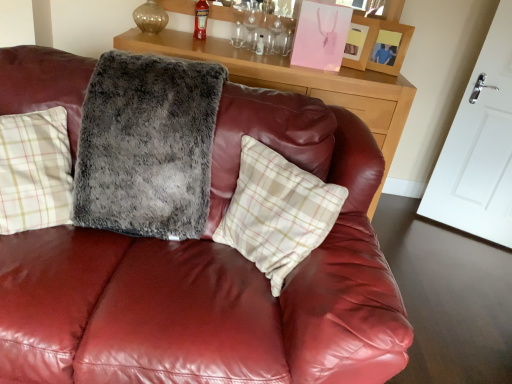
Where is `vacant space to the left of red glass bottle at upper center`? The height and width of the screenshot is (384, 512). vacant space to the left of red glass bottle at upper center is located at coordinates (173, 41).